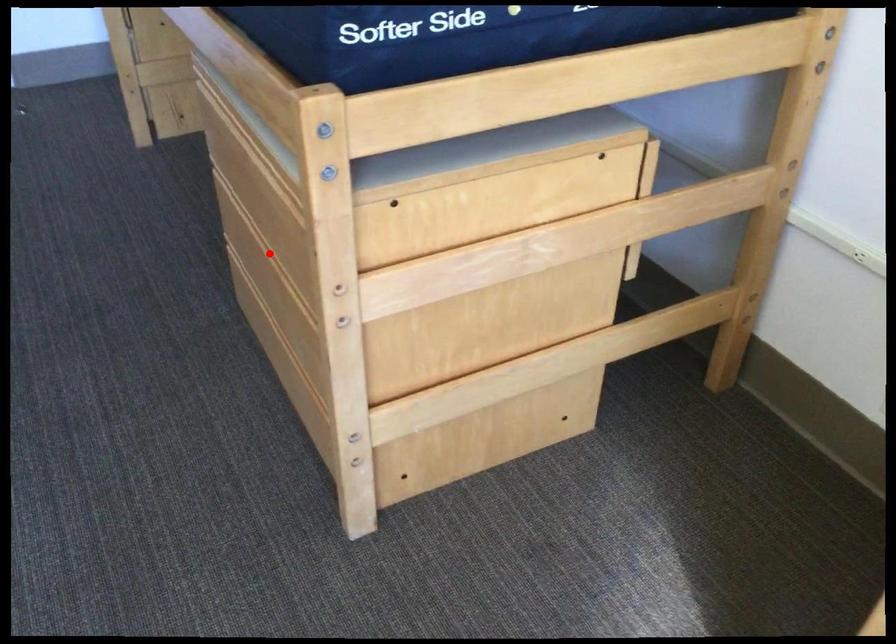
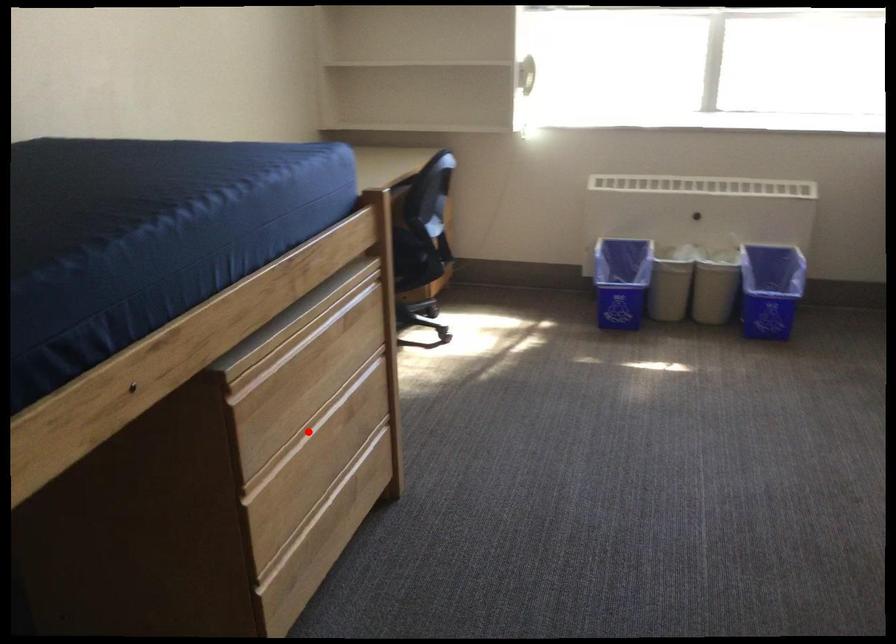
I am providing you with two images of the same scene from different viewpoints. A red point is marked on the first image and another point is marked on the second image. Does the point marked in image1 correspond to the same location as the one in image2?

Yes